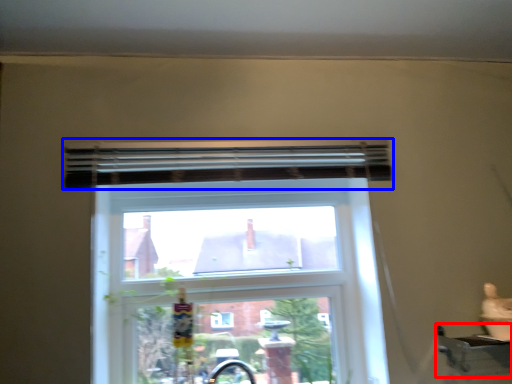
Question: Which point is closer to the camera, window sill (highlighted by a red box) or curtain (highlighted by a blue box)?

Choices:
 (A) window sill
 (B) curtain

Answer: (A)